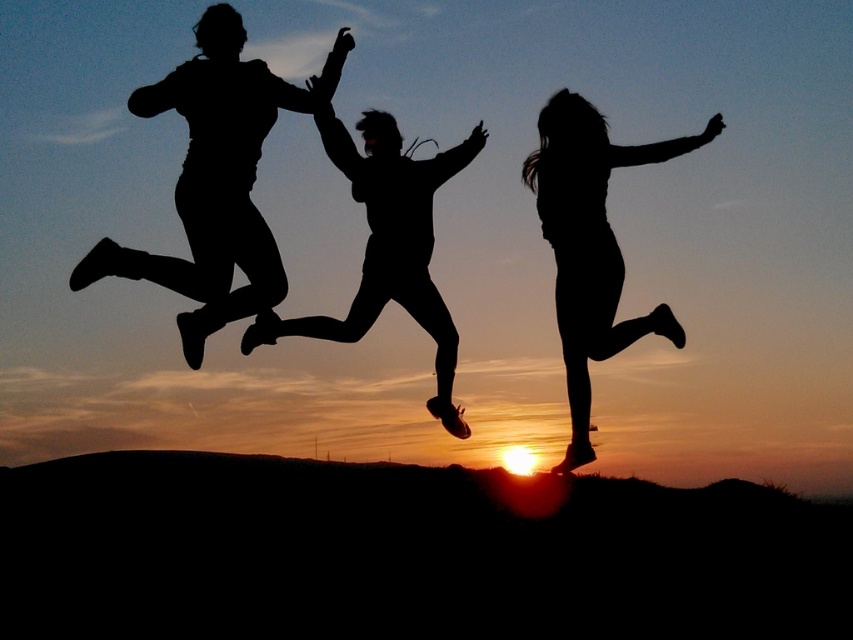
You are a photographer trying to capture the perfect shot of the scene. You want to position yourself so that your camera lens is exactly at point (x=590, y=244). Is there an object at that point that might block your view?

Yes, there is a black matte figure at center located at point (x=590, y=244), which would block your view.

Looking at the sunset scene with the black matte figure at center and the black matte silhouette at center, which one is positioned to the right?

The black matte figure at center is positioned to the right of the black matte silhouette at center.

Based on the photo, you are a photographer trying to capture the sunset scene. You notice two points in the image at coordinates point (662, 148) and point (351, 163). Which point is closer to the camera?

Point (662, 148) is in front of point (351, 163), so it is closer to the camera.